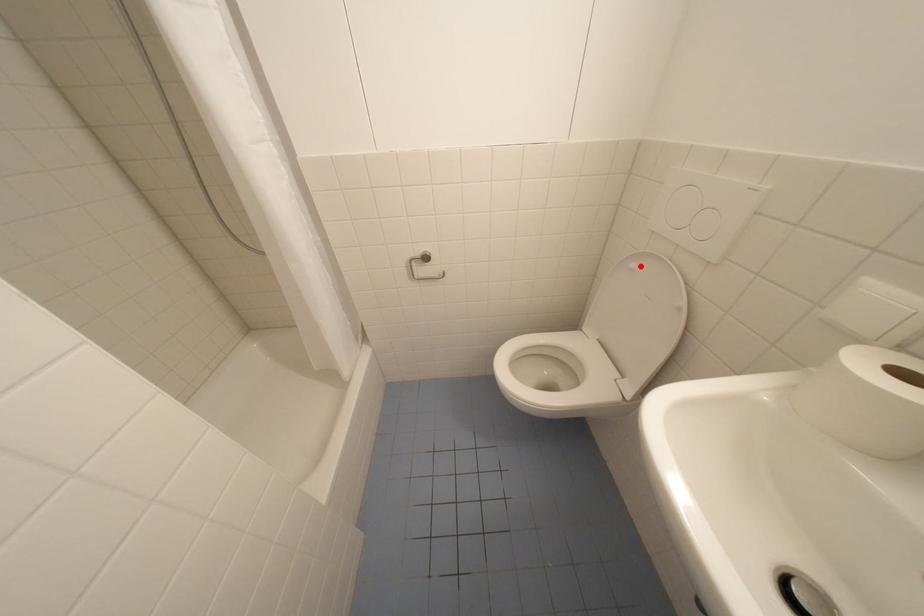
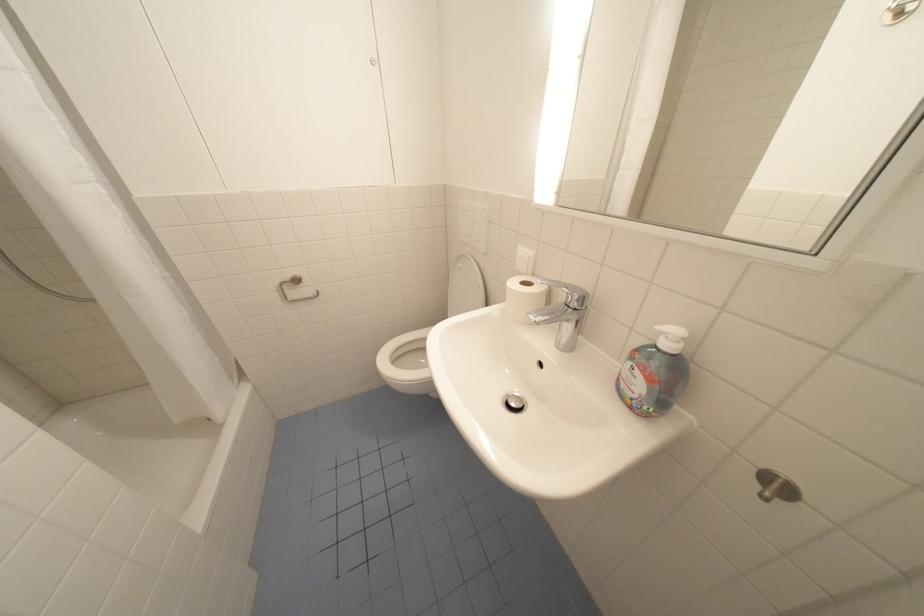
Question: I am providing you with two images of the same scene from different viewpoints. Given a red point in image1, look at the same physical point in image2. Is it:

Choices:
 (A) Closer to the viewpoint
 (B) Farther from the viewpoint

Answer: (B)